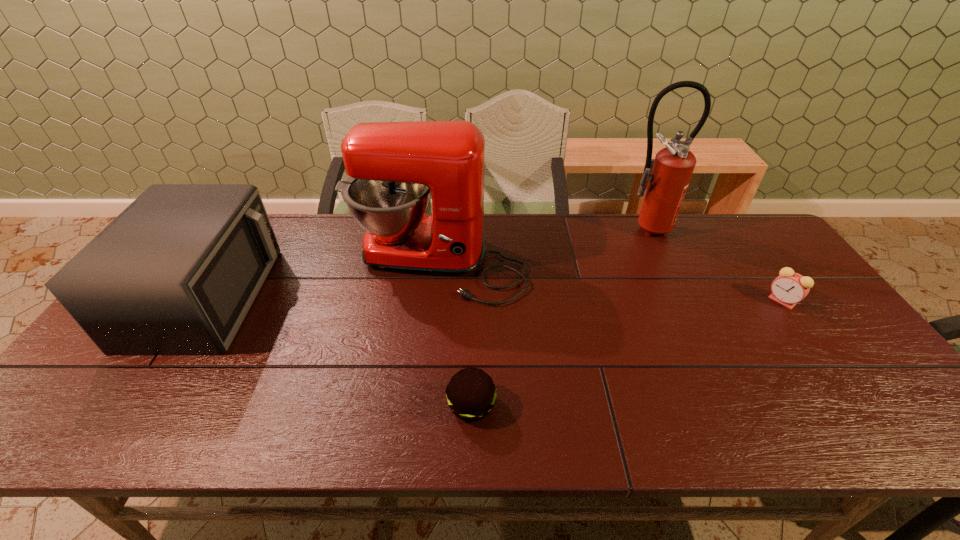
Where is `fire extinguisher`? The image size is (960, 540). fire extinguisher is located at coordinates (670, 172).

At what (x,y) coordinates should I click in order to perform the action: click on the tallest object. Please return your answer as a coordinate pair (x, y). Looking at the image, I should click on (670, 172).

At what (x,y) coordinates should I click in order to perform the action: click on the second tallest object. Please return your answer as a coordinate pair (x, y). This screenshot has height=540, width=960. Looking at the image, I should click on (393, 166).

Where is `the leftmost object`? The image size is (960, 540). the leftmost object is located at coordinates (174, 274).

Where is `microwave oven`? microwave oven is located at coordinates (174, 274).

This screenshot has height=540, width=960. Find the location of `alarm clock`. alarm clock is located at coordinates (789, 288).

Image resolution: width=960 pixels, height=540 pixels. I want to click on patty, so click(x=471, y=394).

The height and width of the screenshot is (540, 960). I want to click on vacant space located at the nozzle of the tallest object, so click(662, 266).

Locate an element on the screen. vacant space located on the front-facing side of the fourth shortest object is located at coordinates (425, 370).

Image resolution: width=960 pixels, height=540 pixels. I want to click on free space located 0.100m on the front-facing side of the third shortest object, so [x=302, y=297].